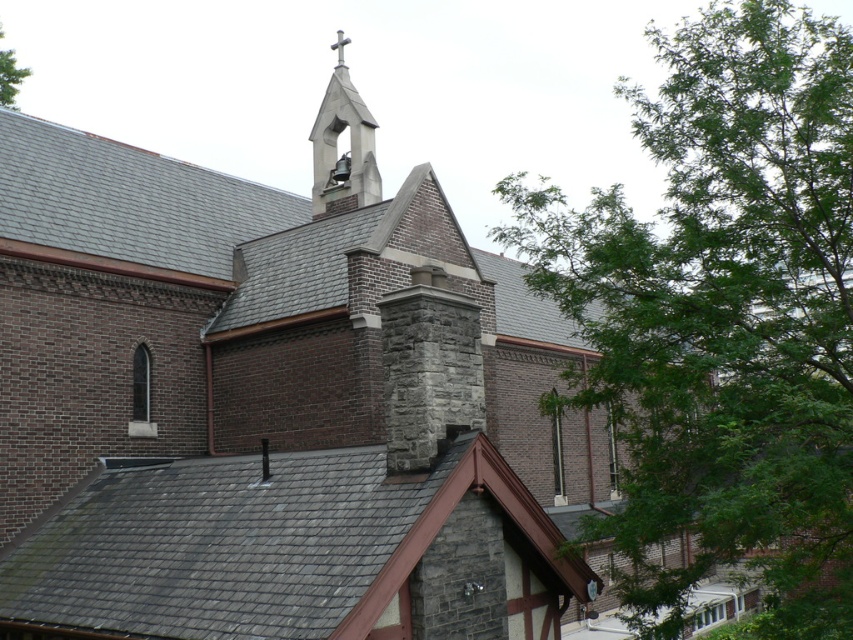
You are standing in front of the church and notice a green leafy tree at upper right and a white stone bell tower at upper center. Which object appears bigger in the image?

The green leafy tree at upper right appears bigger than the white stone bell tower at upper center in the image.

You are a drone operator planning to fly a drone from the green leafy tree at upper right to the white stone bell tower at upper center. What is the approximate distance you need to cover?

The green leafy tree at upper right and white stone bell tower at upper center are 54.36 feet apart, so the drone needs to cover approximately 54.36 feet to fly between them.